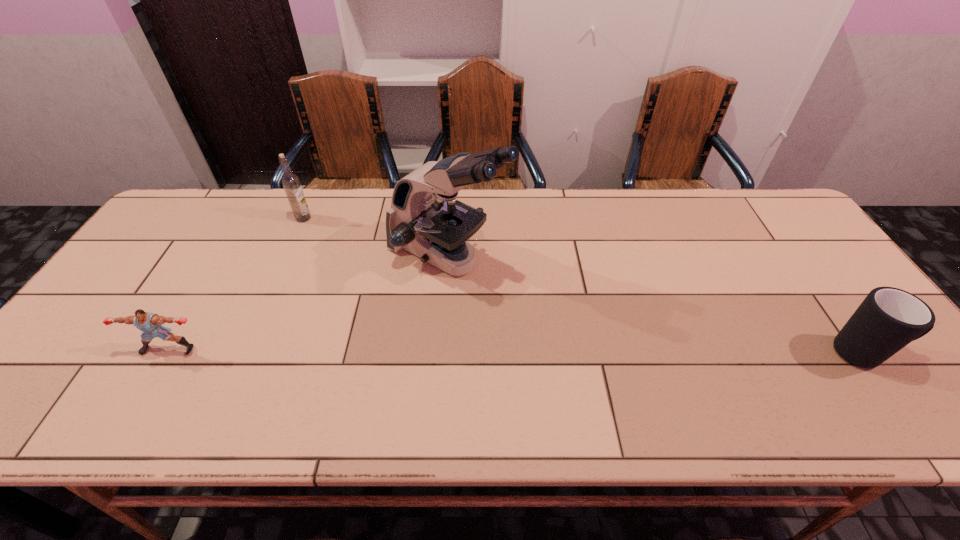
Where is `vacant space on the desktop that is between the leftmost object and the rightmost object and is positioned through the eyepieces of the third nearest object`? Image resolution: width=960 pixels, height=540 pixels. vacant space on the desktop that is between the leftmost object and the rightmost object and is positioned through the eyepieces of the third nearest object is located at coordinates (620, 352).

The width and height of the screenshot is (960, 540). What are the coordinates of `vacant space on the desktop that is between the leftmost object and the mug and is positioned on the label of the vodka` in the screenshot? It's located at (420, 350).